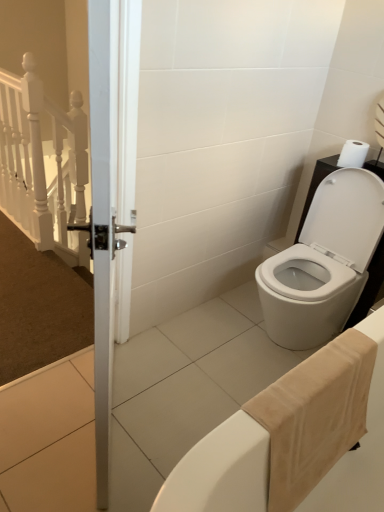
Question: From a real-world perspective, is white matte toilet paper at upper right located higher than beige cotton bath towel at lower right?

Choices:
 (A) yes
 (B) no

Answer: (A)

Question: Considering the relative positions of white matte toilet paper at upper right and beige cotton bath towel at lower right in the image provided, is white matte toilet paper at upper right to the left of beige cotton bath towel at lower right from the viewer's perspective?

Choices:
 (A) no
 (B) yes

Answer: (A)

Question: Is white matte toilet paper at upper right wider than beige cotton bath towel at lower right?

Choices:
 (A) yes
 (B) no

Answer: (B)

Question: Does white matte toilet paper at upper right come behind beige cotton bath towel at lower right?

Choices:
 (A) no
 (B) yes

Answer: (B)

Question: Does white matte toilet paper at upper right turn towards beige cotton bath towel at lower right?

Choices:
 (A) yes
 (B) no

Answer: (B)

Question: From a real-world perspective, is beige cotton bath towel at lower right positioned above or below white matte toilet paper at upper right?

Choices:
 (A) below
 (B) above

Answer: (A)

Question: Considering the positions of beige cotton bath towel at lower right and white matte toilet paper at upper right in the image, is beige cotton bath towel at lower right wider or thinner than white matte toilet paper at upper right?

Choices:
 (A) wide
 (B) thin

Answer: (A)

Question: Is point (332, 431) closer or farther from the camera than point (344, 165)?

Choices:
 (A) closer
 (B) farther

Answer: (A)

Question: From the image's perspective, is beige cotton bath towel at lower right above or below white matte toilet paper at upper right?

Choices:
 (A) above
 (B) below

Answer: (B)

Question: From a real-world perspective, is white glossy toilet at lower right positioned above or below beige cotton bath towel at lower right?

Choices:
 (A) below
 (B) above

Answer: (A)

Question: In terms of width, does white glossy toilet at lower right look wider or thinner when compared to beige cotton bath towel at lower right?

Choices:
 (A) wide
 (B) thin

Answer: (A)

Question: Is white glossy toilet at lower right in front of or behind beige cotton bath towel at lower right in the image?

Choices:
 (A) front
 (B) behind

Answer: (B)

Question: From their relative heights in the image, would you say white glossy toilet at lower right is taller or shorter than beige cotton bath towel at lower right?

Choices:
 (A) tall
 (B) short

Answer: (A)

Question: In terms of size, does white matte toilet paper at upper right appear bigger or smaller than beige cotton bath towel at lower right?

Choices:
 (A) big
 (B) small

Answer: (B)

Question: Relative to beige cotton bath towel at lower right, is white matte toilet paper at upper right in front or behind?

Choices:
 (A) front
 (B) behind

Answer: (B)